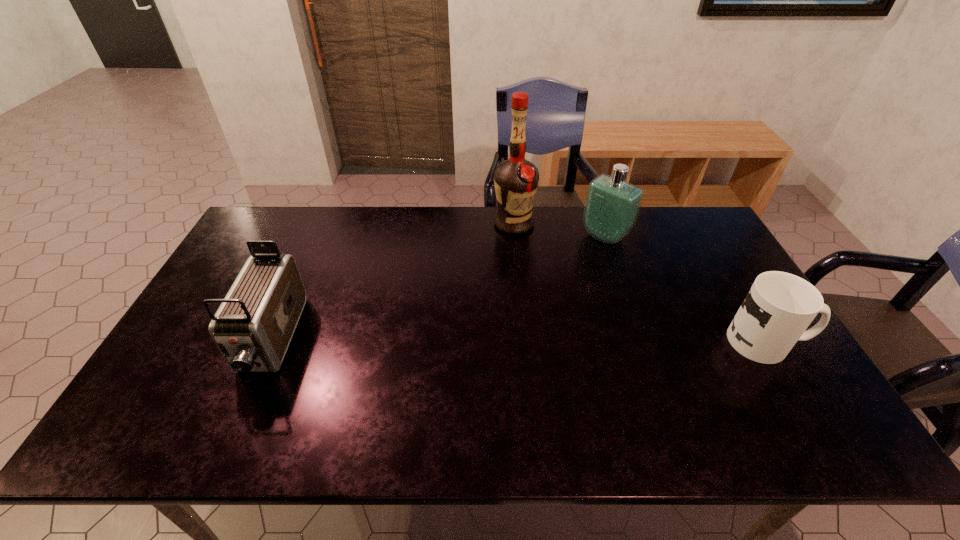
You are a GUI agent. You are given a task and a screenshot of the screen. Output one action in this format:
    pyautogui.click(x=<x>, y=<y>)
    Task: Click on the blank space at the far left corner
    
    Given the screenshot: What is the action you would take?
    (x=289, y=228)

I want to click on free space between the third object from right to left and the camcorder, so click(x=393, y=282).

This screenshot has width=960, height=540. What are the coordinates of `vacant area that lies between the leftmost object and the rightmost object` in the screenshot? It's located at (518, 341).

The image size is (960, 540). In order to click on empty space that is in between the leftmost object and the tallest object in this screenshot , I will do `click(393, 282)`.

Find the location of a particular element. The width and height of the screenshot is (960, 540). blank region between the second object from right to left and the mug is located at coordinates (685, 288).

This screenshot has width=960, height=540. Find the location of `empty space that is in between the leftmost object and the third object from right to left`. empty space that is in between the leftmost object and the third object from right to left is located at coordinates (393, 282).

The height and width of the screenshot is (540, 960). What are the coordinates of `vacant region between the third object from right to left and the camcorder` in the screenshot? It's located at (393, 282).

The width and height of the screenshot is (960, 540). Identify the location of free space between the shortest object and the second object from left to right. (639, 282).

This screenshot has width=960, height=540. I want to click on free space between the shortest object and the third object from right to left, so click(639, 282).

Image resolution: width=960 pixels, height=540 pixels. Find the location of `vacant space that is in between the perfume and the third object from right to left`. vacant space that is in between the perfume and the third object from right to left is located at coordinates [560, 230].